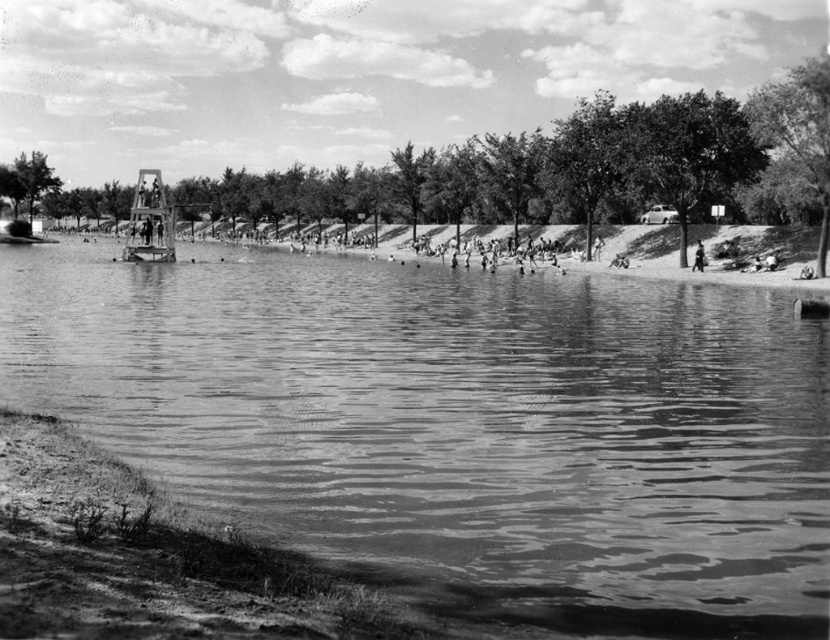
Question: Does smooth water at center appear on the right side of metallic structure at center?

Choices:
 (A) yes
 (B) no

Answer: (A)

Question: Is smooth water at center thinner than metallic structure at center?

Choices:
 (A) no
 (B) yes

Answer: (A)

Question: Which point appears farthest from the camera in this image?

Choices:
 (A) (160, 246)
 (B) (320, 317)

Answer: (A)

Question: Among these points, which one is farthest from the camera?

Choices:
 (A) (409, 458)
 (B) (128, 237)

Answer: (B)

Question: Considering the relative positions of smooth water at center and metallic structure at center in the image provided, where is smooth water at center located with respect to metallic structure at center?

Choices:
 (A) below
 (B) above

Answer: (A)